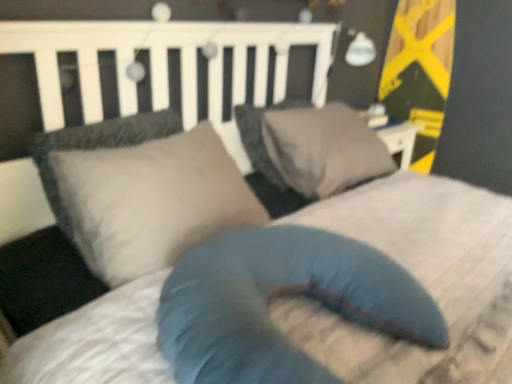
Question: In which direction should I rotate to look at blue fabric pillow at center, the 3th pillow from the back?

Choices:
 (A) right
 (B) left

Answer: (A)

Question: Is gray fabric pillow at center, which is the first pillow in back-to-front order, outside of blue fabric pillow at center, which is the first pillow in front-to-back order?

Choices:
 (A) no
 (B) yes

Answer: (B)

Question: Considering the relative sizes of gray fabric pillow at center, which appears as the third pillow when viewed from the front, and blue fabric pillow at center, the 3th pillow from the back, in the image provided, is gray fabric pillow at center, which appears as the third pillow when viewed from the front, wider than blue fabric pillow at center, the 3th pillow from the back,?

Choices:
 (A) yes
 (B) no

Answer: (B)

Question: Is gray fabric pillow at center, which is the first pillow in back-to-front order, aimed at blue fabric pillow at center, the 3th pillow from the back?

Choices:
 (A) yes
 (B) no

Answer: (B)

Question: Can you confirm if gray fabric pillow at center, which appears as the third pillow when viewed from the front, is taller than blue fabric pillow at center, the 3th pillow from the back?

Choices:
 (A) yes
 (B) no

Answer: (A)

Question: From a real-world perspective, is gray fabric pillow at center, which is the first pillow in back-to-front order, under blue fabric pillow at center, which is the first pillow in front-to-back order?

Choices:
 (A) no
 (B) yes

Answer: (A)

Question: Does gray fabric pillow at center, which appears as the third pillow when viewed from the front, have a smaller size compared to blue fabric pillow at center, the 3th pillow from the back?

Choices:
 (A) yes
 (B) no

Answer: (A)

Question: Is gray fabric pillow at center, which appears as the third pillow when viewed from the front, turned away from matte gray pillow at center, the 2th pillow from the front?

Choices:
 (A) yes
 (B) no

Answer: (B)

Question: Is gray fabric pillow at center, which is the first pillow in back-to-front order, further to the viewer compared to matte gray pillow at center, which appears as the 2th pillow when viewed from the back?

Choices:
 (A) yes
 (B) no

Answer: (A)

Question: Is gray fabric pillow at center, which is the first pillow in back-to-front order, outside of matte gray pillow at center, which appears as the 2th pillow when viewed from the back?

Choices:
 (A) yes
 (B) no

Answer: (A)

Question: Does gray fabric pillow at center, which is the first pillow in back-to-front order, have a greater width compared to matte gray pillow at center, which appears as the 2th pillow when viewed from the back?

Choices:
 (A) no
 (B) yes

Answer: (B)

Question: Is gray fabric pillow at center, which appears as the third pillow when viewed from the front, far away from matte gray pillow at center, the 2th pillow from the front?

Choices:
 (A) no
 (B) yes

Answer: (A)

Question: Considering the relative positions of gray fabric pillow at center, which appears as the third pillow when viewed from the front, and matte gray pillow at center, which appears as the 2th pillow when viewed from the back, in the image provided, is gray fabric pillow at center, which appears as the third pillow when viewed from the front, to the left of matte gray pillow at center, which appears as the 2th pillow when viewed from the back, from the viewer's perspective?

Choices:
 (A) yes
 (B) no

Answer: (B)

Question: Is matte gray pillow at center, the 2th pillow from the front, far from gray fabric pillow at center, which is the first pillow in back-to-front order?

Choices:
 (A) no
 (B) yes

Answer: (A)